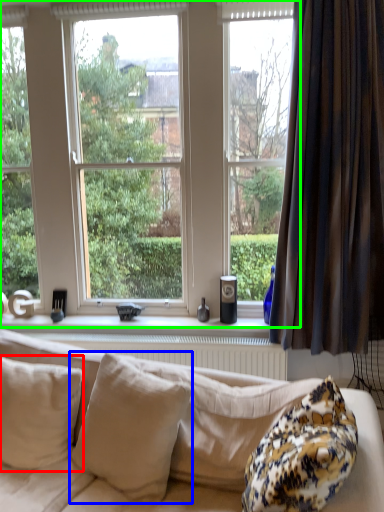
Question: Which is nearer to the pillow (highlighted by a red box)? pillow (highlighted by a blue box) or window (highlighted by a green box).

Choices:
 (A) pillow
 (B) window

Answer: (A)